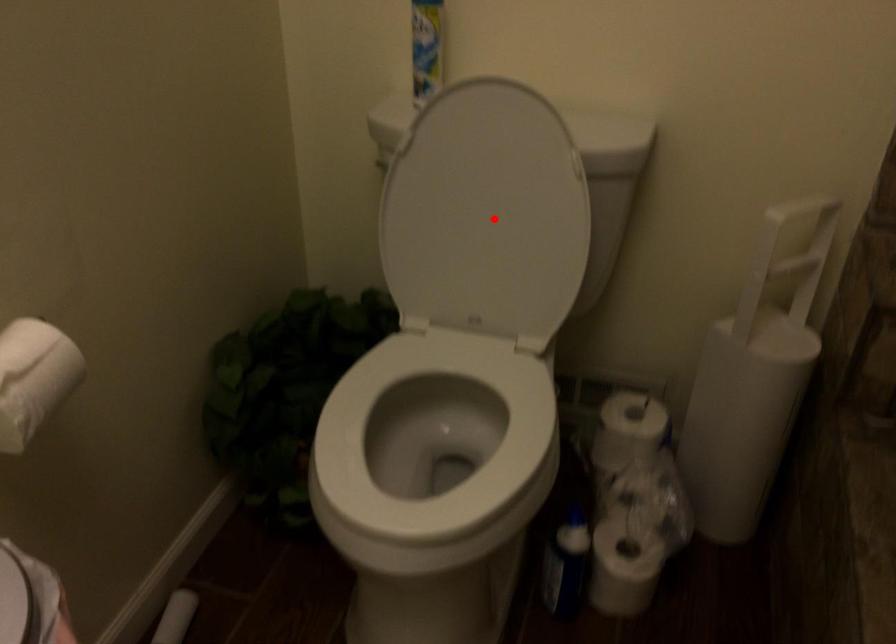
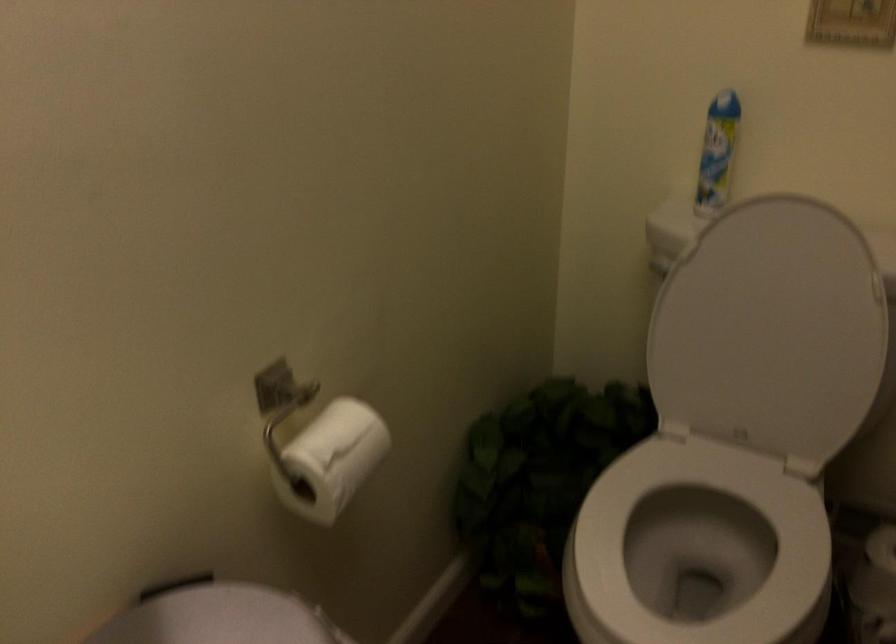
Find the pixel in the second image that matches the highlighted location in the first image.

(771, 330)